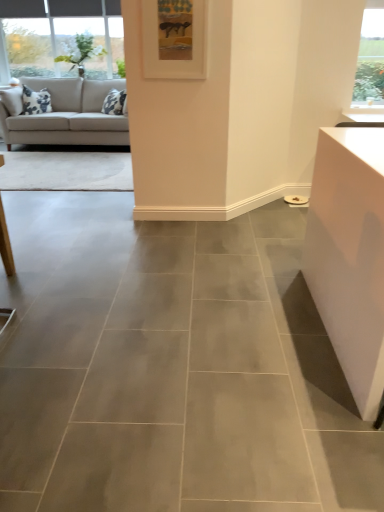
This screenshot has height=512, width=384. Describe the element at coordinates (68, 115) in the screenshot. I see `beige fabric couch at upper left` at that location.

Identify the location of beige fabric couch at upper left. 68,115.

Locate an element on the screen. The image size is (384, 512). white matte picture frame at upper center is located at coordinates 175,39.

This screenshot has width=384, height=512. What do you see at coordinates (175, 39) in the screenshot?
I see `white matte picture frame at upper center` at bounding box center [175, 39].

In order to face white matte picture frame at upper center, should I rotate leftwards or rightwards?

You should rotate left by 2.026 degrees.

Identify the location of beige fabric couch at upper left. (68, 115).

Is beige fabric couch at upper left at the left side of white matte picture frame at upper center?

Yes.

From the picture: Considering their positions, is beige fabric couch at upper left located in front of or behind white matte picture frame at upper center?

Visually, beige fabric couch at upper left is located behind white matte picture frame at upper center.

Which is closer, (15, 127) or (164, 4)?

The point (164, 4) is closer.

From the image's perspective, which is below, beige fabric couch at upper left or white matte picture frame at upper center?

white matte picture frame at upper center.

From a real-world perspective, does beige fabric couch at upper left sit lower than white matte picture frame at upper center?

Yes.

Can you confirm if beige fabric couch at upper left is thinner than white matte picture frame at upper center?

In fact, beige fabric couch at upper left might be wider than white matte picture frame at upper center.

Can you confirm if beige fabric couch at upper left is shorter than white matte picture frame at upper center?

No, beige fabric couch at upper left is not shorter than white matte picture frame at upper center.

Who is smaller, beige fabric couch at upper left or white matte picture frame at upper center?

With smaller size is white matte picture frame at upper center.

Is white matte picture frame at upper center a part of beige fabric couch at upper left?

No, white matte picture frame at upper center is not surrounded by beige fabric couch at upper left.

Is the surface of beige fabric couch at upper left in direct contact with white matte picture frame at upper center?

beige fabric couch at upper left and white matte picture frame at upper center are clearly separated.

Is beige fabric couch at upper left looking in the opposite direction of white matte picture frame at upper center?

beige fabric couch at upper left is not turned away from white matte picture frame at upper center.

How distant is beige fabric couch at upper left from white matte picture frame at upper center?

beige fabric couch at upper left and white matte picture frame at upper center are 2.71 meters apart from each other.

This screenshot has width=384, height=512. What are the coordinates of `picture frame located above the beige fabric couch at upper left (from a real-world perspective)` in the screenshot? It's located at (175, 39).

Which is more to the right, white matte picture frame at upper center or beige fabric couch at upper left?

Positioned to the right is white matte picture frame at upper center.

Is white matte picture frame at upper center further to camera compared to beige fabric couch at upper left?

No, white matte picture frame at upper center is in front of beige fabric couch at upper left.

Which is in front, point (193, 52) or point (82, 106)?

The point (193, 52) is closer to the camera.

From the image's perspective, is white matte picture frame at upper center below beige fabric couch at upper left?

Yes, from the image's perspective, white matte picture frame at upper center is below beige fabric couch at upper left.

From a real-world perspective, is white matte picture frame at upper center physically above beige fabric couch at upper left?

Yes.

In terms of width, does white matte picture frame at upper center look wider or thinner when compared to beige fabric couch at upper left?

Clearly, white matte picture frame at upper center has less width compared to beige fabric couch at upper left.

Considering the sizes of white matte picture frame at upper center and beige fabric couch at upper left in the image, is white matte picture frame at upper center taller or shorter than beige fabric couch at upper left?

In the image, white matte picture frame at upper center appears to be shorter than beige fabric couch at upper left.

Between white matte picture frame at upper center and beige fabric couch at upper left, which one has smaller size?

With smaller size is white matte picture frame at upper center.

Consider the image. Can beige fabric couch at upper left be found inside white matte picture frame at upper center?

No, beige fabric couch at upper left is not surrounded by white matte picture frame at upper center.

From the picture: Is white matte picture frame at upper center beside beige fabric couch at upper left?

white matte picture frame at upper center and beige fabric couch at upper left are clearly separated.

Could you tell me if white matte picture frame at upper center is facing beige fabric couch at upper left?

No, white matte picture frame at upper center is not turned towards beige fabric couch at upper left.

Locate an element on the screen. The height and width of the screenshot is (512, 384). picture frame positioned vertically above the beige fabric couch at upper left (from a real-world perspective) is located at coordinates (175, 39).

Image resolution: width=384 pixels, height=512 pixels. I want to click on picture frame in front of the beige fabric couch at upper left, so click(x=175, y=39).

Identify the location of picture frame that appears above the beige fabric couch at upper left (from a real-world perspective). (175, 39).